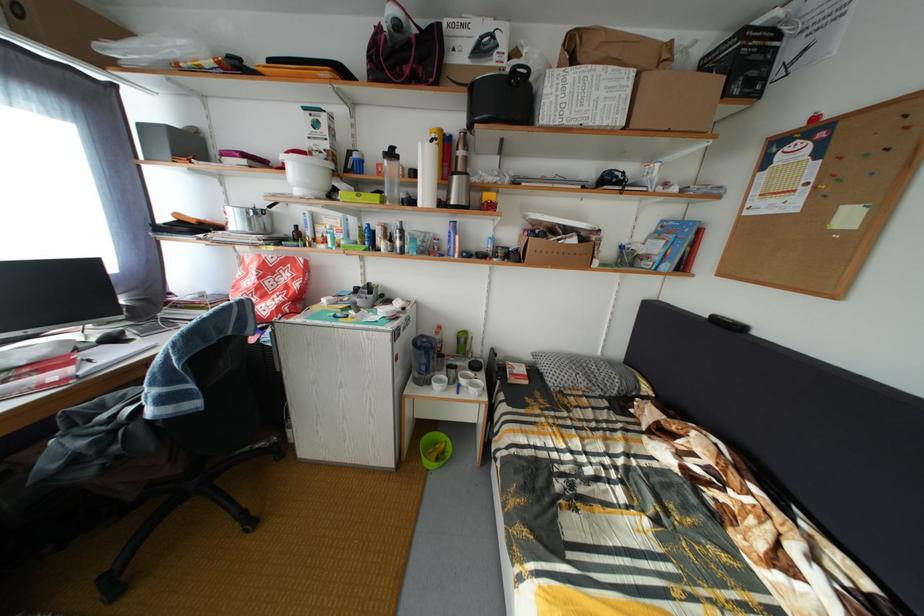
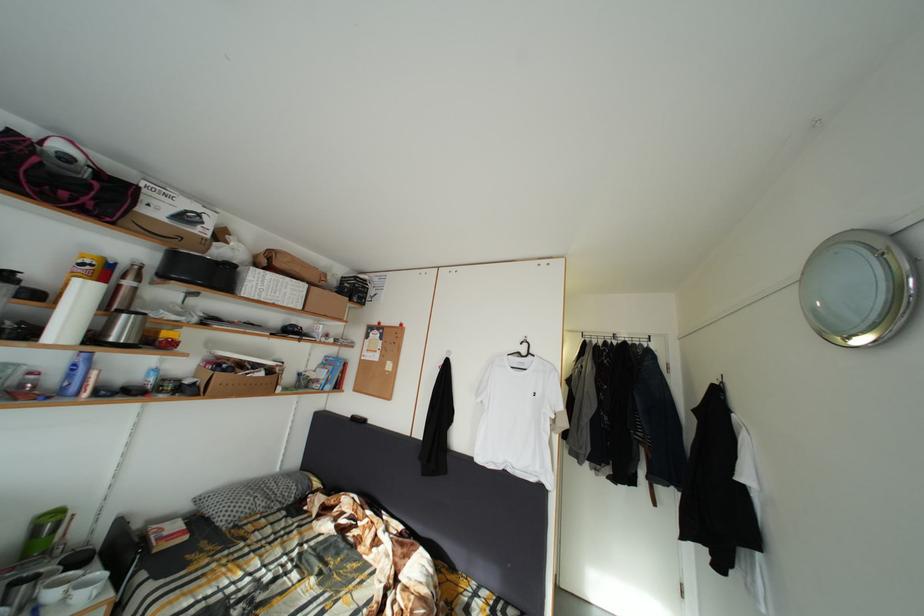
Where in the second image is the point corresponding to point 576,237 from the first image?

(264, 373)